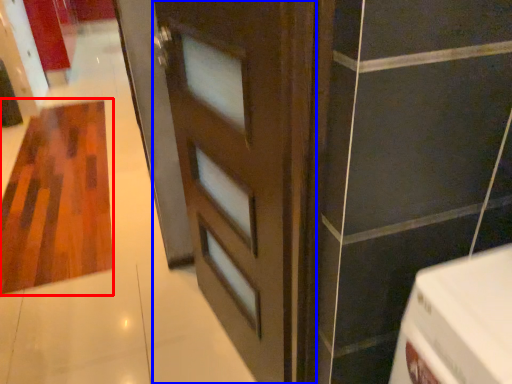
Question: Which object appears closest to the camera in this image, hardwood (highlighted by a red box) or door (highlighted by a blue box)?

Choices:
 (A) hardwood
 (B) door

Answer: (B)